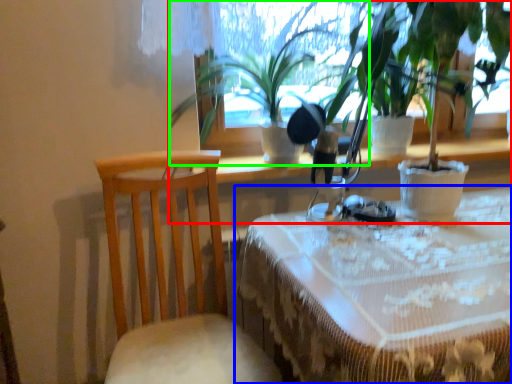
Question: Which is farther away from houseplant (highlighted by a red box)? table (highlighted by a blue box) or houseplant (highlighted by a green box)?

Choices:
 (A) table
 (B) houseplant

Answer: (A)